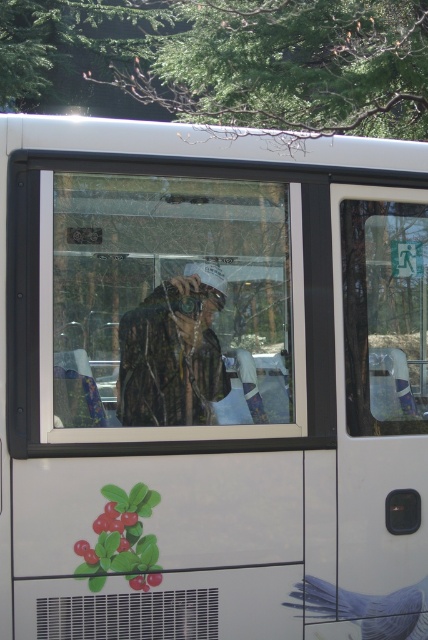
Question: Can you confirm if transparent glass window at center is bigger than transparent glass door at right?

Choices:
 (A) yes
 (B) no

Answer: (A)

Question: Is transparent glass window at center wider than transparent glass door at right?

Choices:
 (A) no
 (B) yes

Answer: (B)

Question: Which is farther from the smooth blue bird at lower right?

Choices:
 (A) transparent glass door at right
 (B) transparent glass window at center

Answer: (B)

Question: Which of the following is the farthest from the observer?

Choices:
 (A) transparent glass door at right
 (B) smooth blue bird at lower right
 (C) transparent glass window at center

Answer: (A)

Question: Which point appears closest to the camera in this image?

Choices:
 (A) (421, 316)
 (B) (234, 372)
 (C) (395, 636)

Answer: (B)

Question: Does transparent glass window at center appear over smooth blue bird at lower right?

Choices:
 (A) no
 (B) yes

Answer: (B)